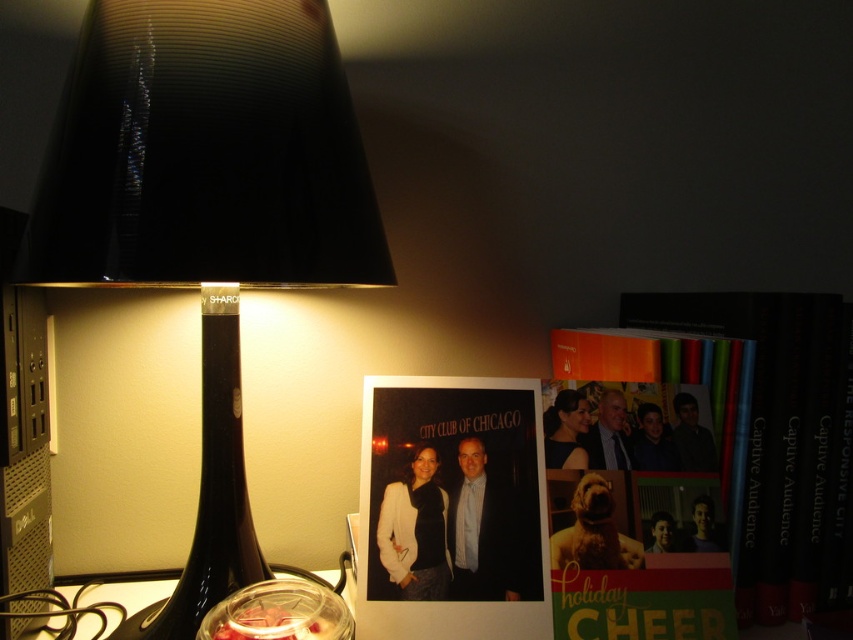
Is black glass lamp at left in front of black glass wine bottle at left?

That is True.

Does black glass lamp at left have a greater width compared to black glass wine bottle at left?

Yes.

Describe the element at coordinates (206, 211) in the screenshot. The image size is (853, 640). I see `black glass lamp at left` at that location.

Where is `black glass lamp at left`? The height and width of the screenshot is (640, 853). black glass lamp at left is located at coordinates (206, 211).

Can you confirm if matte orange book at center right is smaller than matte paper photo at center?

Actually, matte orange book at center right might be larger than matte paper photo at center.

Does matte orange book at center right appear over matte paper photo at center?

Correct, matte orange book at center right is located above matte paper photo at center.

Describe the element at coordinates (646, 492) in the screenshot. I see `matte orange book at center right` at that location.

The image size is (853, 640). Find the location of `matte orange book at center right`. matte orange book at center right is located at coordinates (646, 492).

Between matte paper photo at center and hardcover book at right, which one appears on the left side from the viewer's perspective?

From the viewer's perspective, matte paper photo at center appears more on the left side.

Does matte paper photo at center have a greater width compared to hardcover book at right?

Indeed, matte paper photo at center has a greater width compared to hardcover book at right.

Does point (469, 611) come behind point (747, 593)?

No, it is in front of (747, 593).

Where is `matte paper photo at center`? matte paper photo at center is located at coordinates coord(451,509).